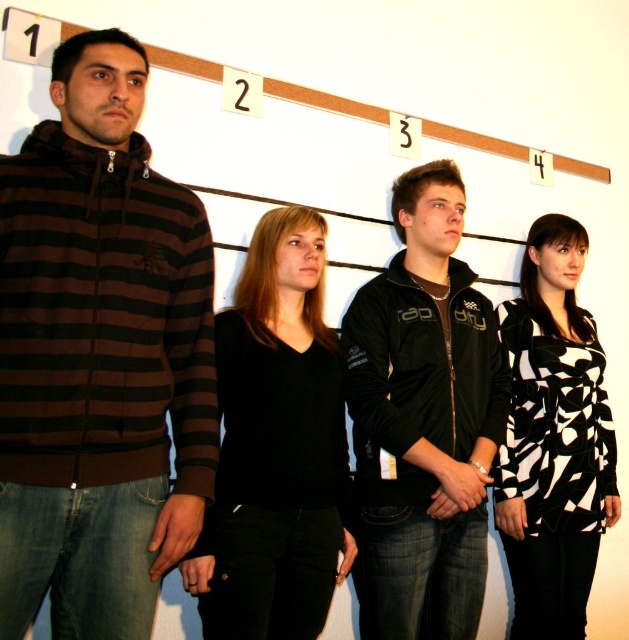
You are a photographer setting up for a group photo. You need to ensure that the brown striped hoodie at left and the black matte jacket at center are aligned properly. Based on the scene, which of these two items should be positioned higher in the frame?

The brown striped hoodie at left should be positioned higher in the frame because it is located above the black matte jacket at center.

You are a photographer who needs to adjust the positions of the brown striped hoodie at left and the black matte sweater at center so that they are aligned with the numbered labels above them. Which direction should you move each person to make their positions match the labels?

The brown striped hoodie at left is already on the left side of the black matte sweater at center, so to align with the numbered labels, you should move the black matte sweater at center to the right to match label 2 and move the brown striped hoodie at left to the left to match label 1.

You are a photographer who needs to adjust the lighting so that both the brown striped hoodie at left and the black and white printed dress at center are equally visible. Which clothing item requires more light to be shone on it?

The brown striped hoodie at left requires more light because it has a smaller size compared to the black and white printed dress at center, so to make them appear equally visible, the smaller one needs more light to compensate for its size.